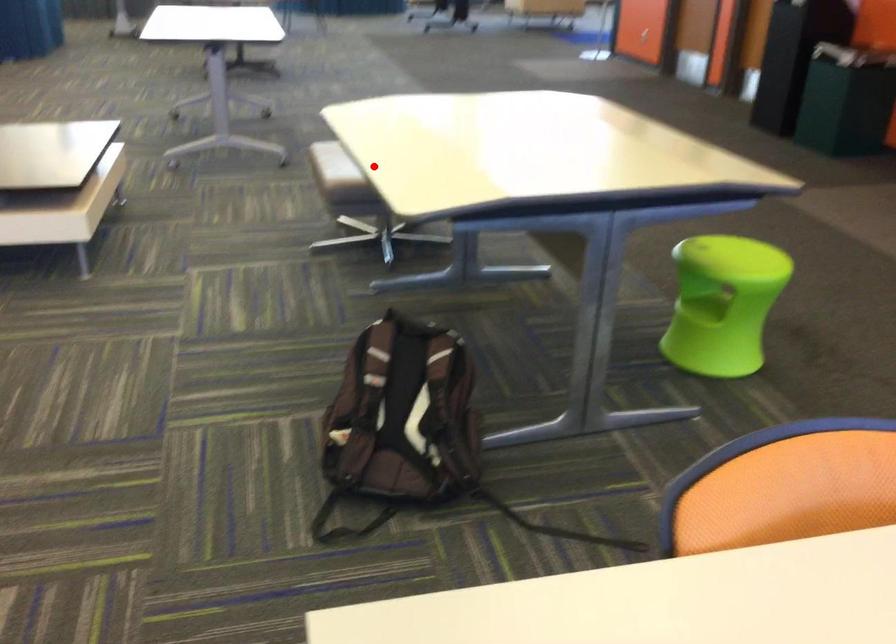
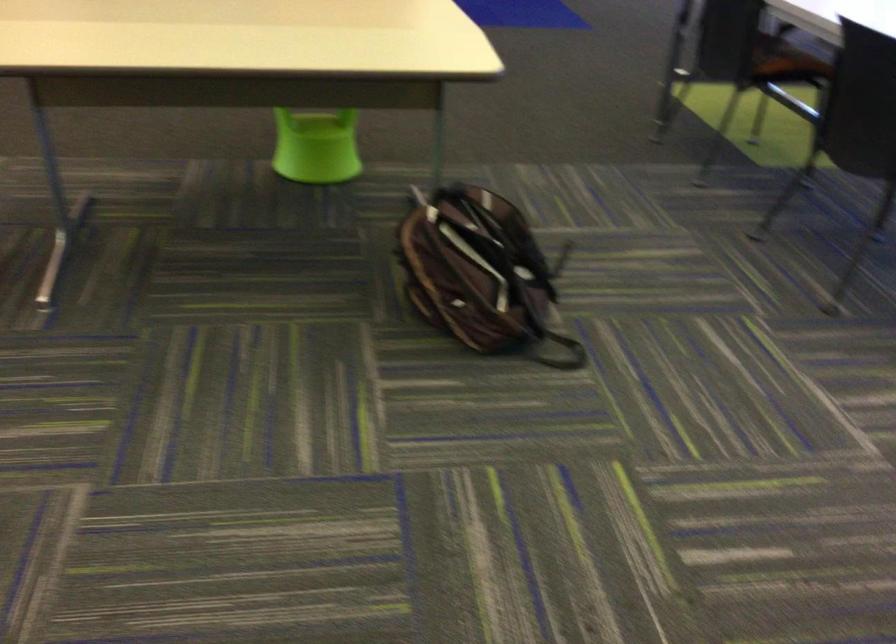
Find the pixel in the second image that matches the highlighted location in the first image.

(322, 67)